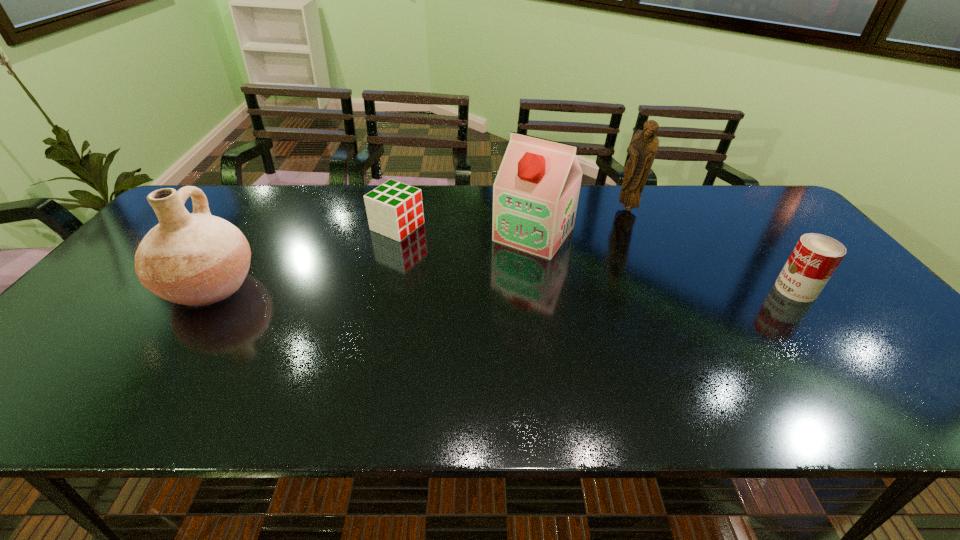
I want to click on unoccupied area between the leftmost object and the second object from right to left, so click(420, 248).

This screenshot has width=960, height=540. Identify the location of vacant space that is in between the second shortest object and the third object from left to right. (664, 261).

I want to click on empty space between the fourth tallest object and the leftmost object, so click(503, 288).

Identify the location of free space that is in between the pottery and the third object from right to left. The image size is (960, 540). (372, 260).

Where is `vacant area that lies between the soya milk and the pottery`? The width and height of the screenshot is (960, 540). vacant area that lies between the soya milk and the pottery is located at coordinates (372, 260).

Find the location of a particular element. Image resolution: width=960 pixels, height=540 pixels. free spot between the figurine and the leftmost object is located at coordinates (420, 248).

You are a GUI agent. You are given a task and a screenshot of the screen. Output one action in this format:
    pyautogui.click(x=<x>, y=<y>)
    Task: Click on the vacant space in between the can and the third object from left to right
    Image resolution: width=960 pixels, height=540 pixels.
    Given the screenshot: What is the action you would take?
    pyautogui.click(x=664, y=261)

Where is `unoccupied area between the fourth object from left to right and the pottery`? Image resolution: width=960 pixels, height=540 pixels. unoccupied area between the fourth object from left to right and the pottery is located at coordinates (420, 248).

The image size is (960, 540). I want to click on vacant space in between the rightmost object and the soya milk, so click(x=664, y=261).

I want to click on free space between the pottery and the soya milk, so click(372, 260).